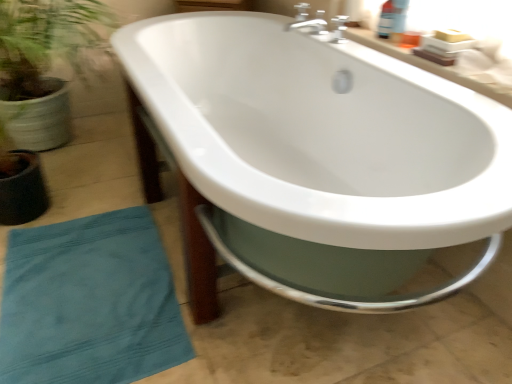
Identify the location of white glossy bathtub at center. This screenshot has height=384, width=512. (317, 158).

Measure the distance between point (476, 74) and camera.

The depth of point (476, 74) is 1.17 meters.

Image resolution: width=512 pixels, height=384 pixels. I want to click on white glossy bathtub at center, so click(x=317, y=158).

Are white glossy countertop at upper right and teal cotton beach towel at lower left located far from each other?

Indeed, white glossy countertop at upper right is not near teal cotton beach towel at lower left.

In the scene shown: Is teal cotton beach towel at lower left surrounded by white glossy countertop at upper right?

No, white glossy countertop at upper right does not contain teal cotton beach towel at lower left.

From the image's perspective, is white glossy countertop at upper right above or below teal cotton beach towel at lower left?

white glossy countertop at upper right is above teal cotton beach towel at lower left.

Between white glossy countertop at upper right and teal cotton beach towel at lower left, which one appears on the right side from the viewer's perspective?

Positioned to the right is white glossy countertop at upper right.

Is white glossy countertop at upper right at the left side of white glossy bathtub at center?

In fact, white glossy countertop at upper right is to the right of white glossy bathtub at center.

From the image's perspective, which object appears higher, white glossy countertop at upper right or white glossy bathtub at center?

white glossy countertop at upper right appears higher in the image.

From a real-world perspective, which is physically above, white glossy countertop at upper right or white glossy bathtub at center?

white glossy countertop at upper right is physically above.

Is white glossy bathtub at center not near white glossy countertop at upper right?

No.

Is white glossy countertop at upper right a part of white glossy bathtub at center?

Actually, white glossy countertop at upper right is outside white glossy bathtub at center.

From the image's perspective, relative to white glossy countertop at upper right, is white glossy bathtub at center above or below?

From the image's perspective, white glossy bathtub at center appears below white glossy countertop at upper right.

Looking at their sizes, would you say teal cotton beach towel at lower left is wider or thinner than white glossy bathtub at center?

Clearly, teal cotton beach towel at lower left has less width compared to white glossy bathtub at center.

From the picture: Between teal cotton beach towel at lower left and white glossy bathtub at center, which one has less height?

With less height is teal cotton beach towel at lower left.

Who is more distant, teal cotton beach towel at lower left or white glossy bathtub at center?

teal cotton beach towel at lower left is more distant.

Which object is thinner, white glossy bathtub at center or teal cotton beach towel at lower left?

teal cotton beach towel at lower left.

Looking at the image, does white glossy bathtub at center seem bigger or smaller compared to teal cotton beach towel at lower left?

white glossy bathtub at center is bigger than teal cotton beach towel at lower left.

Is white glossy bathtub at center positioned behind teal cotton beach towel at lower left?

No, it is in front of teal cotton beach towel at lower left.

Does point (423, 97) lie behind point (34, 382)?

Yes.

Could you tell me if teal cotton beach towel at lower left is turned towards white glossy countertop at upper right?

No, teal cotton beach towel at lower left is not facing towards white glossy countertop at upper right.

Which is behind, teal cotton beach towel at lower left or white glossy countertop at upper right?

white glossy countertop at upper right is further from the camera.

Would you say teal cotton beach towel at lower left is a long distance from white glossy countertop at upper right?

Yes, teal cotton beach towel at lower left is far from white glossy countertop at upper right.

You are a GUI agent. You are given a task and a screenshot of the screen. Output one action in this format:
    pyautogui.click(x=<x>, y=<y>)
    Task: Click on the beach towel in front of the white glossy countertop at upper right
    This screenshot has height=384, width=512.
    Given the screenshot: What is the action you would take?
    90,302

Locate an element on the screen. Image resolution: width=512 pixels, height=384 pixels. bathtub on the left side of white glossy countertop at upper right is located at coordinates (317, 158).

Based on their spatial positions, is white glossy countertop at upper right or white glossy bathtub at center further from teal cotton beach towel at lower left?

white glossy countertop at upper right lies further to teal cotton beach towel at lower left than the other object.

Which object lies further to the anchor point white glossy bathtub at center, white glossy countertop at upper right or teal cotton beach towel at lower left?

Based on the image, teal cotton beach towel at lower left appears to be further to white glossy bathtub at center.

Estimate the real-world distances between objects in this image. Which object is further from white glossy countertop at upper right, white glossy bathtub at center or teal cotton beach towel at lower left?

The object further to white glossy countertop at upper right is teal cotton beach towel at lower left.

In the scene shown: Based on their spatial positions, is teal cotton beach towel at lower left or white glossy bathtub at center further from white glossy countertop at upper right?

teal cotton beach towel at lower left is positioned further to the anchor white glossy countertop at upper right.

Looking at the image, which one is located further to teal cotton beach towel at lower left, white glossy bathtub at center or white glossy countertop at upper right?

The object further to teal cotton beach towel at lower left is white glossy countertop at upper right.

Considering their positions, is teal cotton beach towel at lower left positioned closer to white glossy bathtub at center than white glossy countertop at upper right?

white glossy countertop at upper right is positioned closer to the anchor white glossy bathtub at center.

At what (x,y) coordinates should I click in order to perform the action: click on bathtub situated between teal cotton beach towel at lower left and white glossy countertop at upper right from left to right. Please return your answer as a coordinate pair (x, y). Looking at the image, I should click on (317, 158).